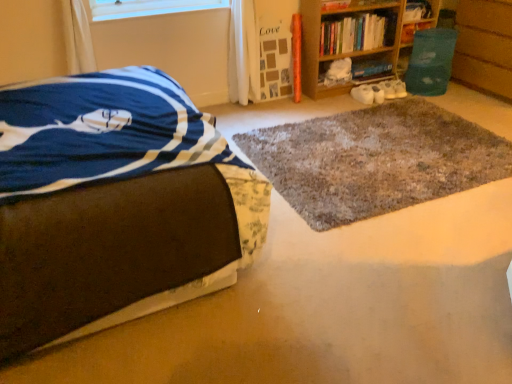
Question: Are hardcover book at upper right, positioned as the third book in left-to-right order, and wooden bookshelf at upper right, which appears as the first book when viewed from the left, far apart?

Choices:
 (A) no
 (B) yes

Answer: (A)

Question: From the image's perspective, would you say hardcover book at upper right, the second book in the right-to-left sequence, is shown under wooden bookshelf at upper right, which appears as the first book when viewed from the left?

Choices:
 (A) no
 (B) yes

Answer: (A)

Question: Is hardcover book at upper right, positioned as the third book in left-to-right order, aimed at wooden bookshelf at upper right, which appears as the first book when viewed from the left?

Choices:
 (A) yes
 (B) no

Answer: (B)

Question: Is hardcover book at upper right, positioned as the third book in left-to-right order, further to camera compared to wooden bookshelf at upper right, the 4th book positioned from the right?

Choices:
 (A) no
 (B) yes

Answer: (B)

Question: Is hardcover book at upper right, positioned as the third book in left-to-right order, placed right next to wooden bookshelf at upper right, which appears as the first book when viewed from the left?

Choices:
 (A) yes
 (B) no

Answer: (B)

Question: Is hardcover book at upper right, positioned as the third book in left-to-right order, at the left side of wooden bookshelf at upper right, the 4th book positioned from the right?

Choices:
 (A) yes
 (B) no

Answer: (B)

Question: From the image's perspective, is wooden bookshelf at upper right located above hardcover book at upper right, which appears as the 1th book when viewed from the right?

Choices:
 (A) no
 (B) yes

Answer: (A)

Question: Is wooden bookshelf at upper right closer to the viewer compared to hardcover book at upper right, which appears as the 1th book when viewed from the right?

Choices:
 (A) no
 (B) yes

Answer: (B)

Question: Is wooden bookshelf at upper right outside hardcover book at upper right, which is the 4th book in left-to-right order?

Choices:
 (A) yes
 (B) no

Answer: (A)

Question: Considering the relative sizes of wooden bookshelf at upper right and hardcover book at upper right, which appears as the 1th book when viewed from the right, in the image provided, is wooden bookshelf at upper right taller than hardcover book at upper right, which appears as the 1th book when viewed from the right,?

Choices:
 (A) yes
 (B) no

Answer: (A)

Question: Is wooden bookshelf at upper right positioned with its back to hardcover book at upper right, which appears as the 1th book when viewed from the right?

Choices:
 (A) yes
 (B) no

Answer: (B)

Question: Would you say wooden bookshelf at upper right is a long distance from hardcover book at upper right, which is the 4th book in left-to-right order?

Choices:
 (A) yes
 (B) no

Answer: (B)

Question: Is hardcover book at upper right, the second book in the right-to-left sequence, far away from hardcover book at upper right, which is the 4th book in left-to-right order?

Choices:
 (A) yes
 (B) no

Answer: (B)